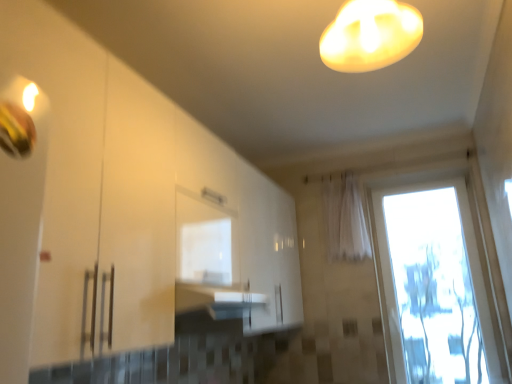
Question: Does white glossy lampshade at upper center have a larger size compared to white glossy cabinet at center?

Choices:
 (A) no
 (B) yes

Answer: (A)

Question: Are white glossy lampshade at upper center and white glossy cabinet at center far apart?

Choices:
 (A) yes
 (B) no

Answer: (B)

Question: Considering the relative sizes of white glossy lampshade at upper center and white glossy cabinet at center in the image provided, is white glossy lampshade at upper center thinner than white glossy cabinet at center?

Choices:
 (A) no
 (B) yes

Answer: (B)

Question: Would you say white glossy lampshade at upper center contains white glossy cabinet at center?

Choices:
 (A) yes
 (B) no

Answer: (B)

Question: From the image's perspective, is white glossy lampshade at upper center below white glossy cabinet at center?

Choices:
 (A) yes
 (B) no

Answer: (B)

Question: Is white glossy lampshade at upper center wider than white glossy cabinet at center?

Choices:
 (A) yes
 (B) no

Answer: (B)

Question: Is transparent glass door at right smaller than white sheer curtain at center?

Choices:
 (A) no
 (B) yes

Answer: (A)

Question: Can you confirm if transparent glass door at right is shorter than white sheer curtain at center?

Choices:
 (A) no
 (B) yes

Answer: (A)

Question: Is transparent glass door at right oriented away from white sheer curtain at center?

Choices:
 (A) no
 (B) yes

Answer: (A)

Question: From a real-world perspective, is transparent glass door at right physically above white sheer curtain at center?

Choices:
 (A) yes
 (B) no

Answer: (B)

Question: Does transparent glass door at right have a lesser width compared to white sheer curtain at center?

Choices:
 (A) no
 (B) yes

Answer: (A)

Question: Considering the relative sizes of transparent glass door at right and white sheer curtain at center in the image provided, is transparent glass door at right bigger than white sheer curtain at center?

Choices:
 (A) no
 (B) yes

Answer: (B)

Question: Is transparent glass door at right beside white glossy cabinet at center?

Choices:
 (A) no
 (B) yes

Answer: (A)